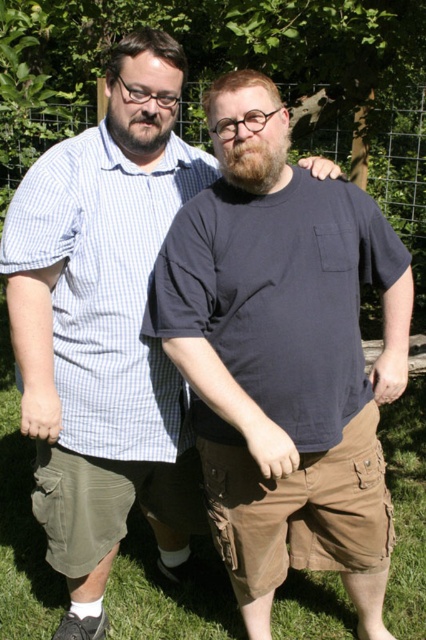
You are planning to install a new fence in your backyard. You have a roll of wire mesh that is 2 meters wide. Based on the image, will the wire mesh fence at upper center fit into the space where the green grass at lower center is currently located?

The green grass at lower center is wider than the wire mesh fence at upper center. Since the wire mesh roll is 2 meters wide, it should fit within the space currently occupied by the green grass at lower center as long as the grass area is at least 2 meters wide.